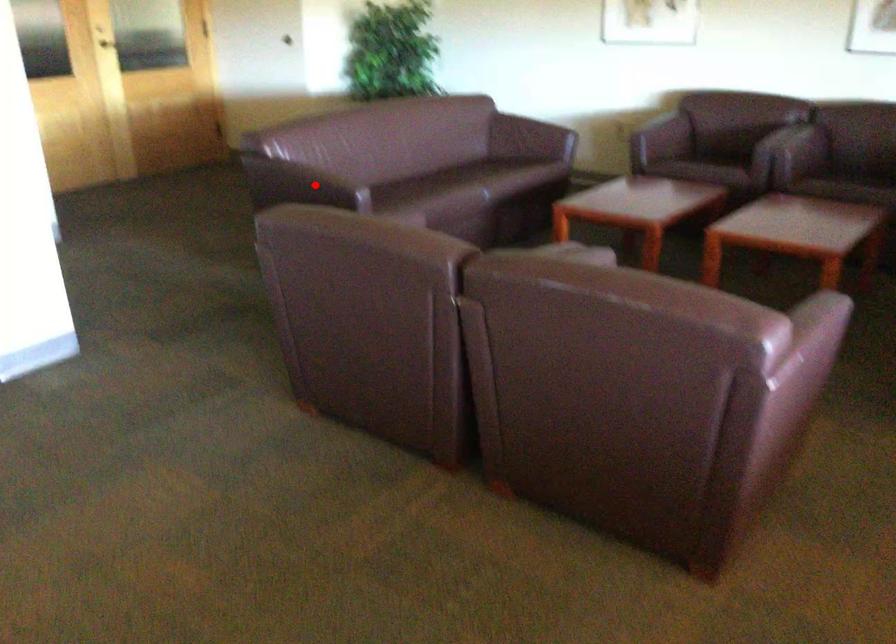
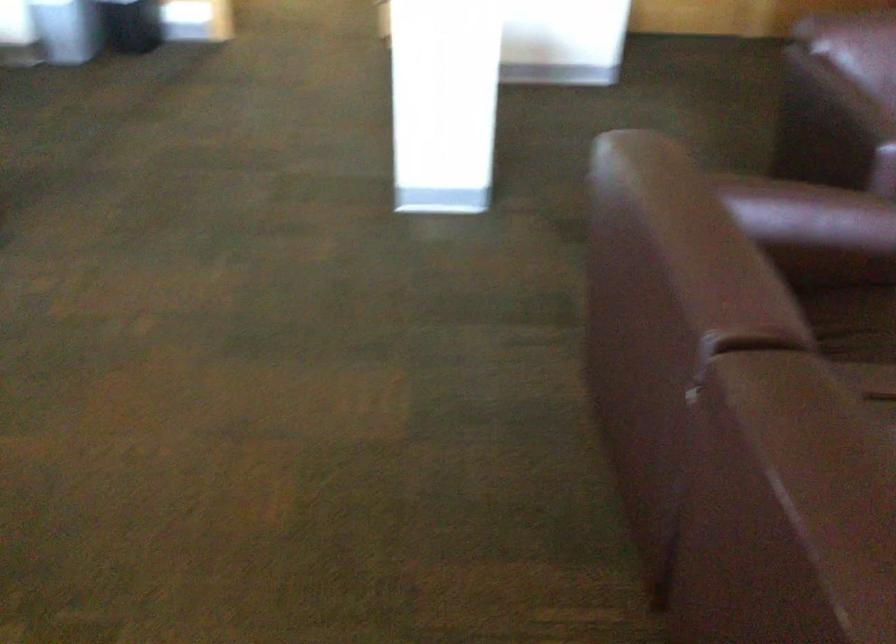
Question: I am providing you with two images of the same scene from different viewpoints. Image1 has a red point marked. In image2, the corresponding 3D location appears at what relative position? Reply with the corresponding letter.

Choices:
 (A) Closer
 (B) Farther

Answer: (A)